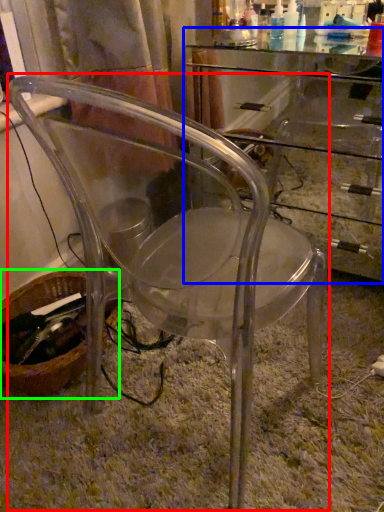
Question: Which object is positioned farthest from chair (highlighted by a red box)? Select from computer desk (highlighted by a blue box) and basket (highlighted by a green box).

Choices:
 (A) computer desk
 (B) basket

Answer: (A)